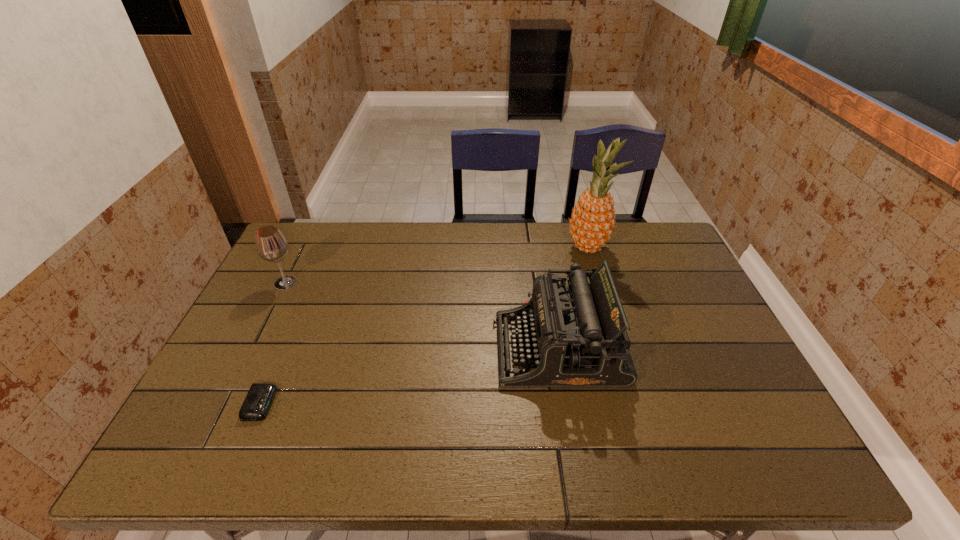
You are a GUI agent. You are given a task and a screenshot of the screen. Output one action in this format:
    pyautogui.click(x=<x>, y=<y>)
    Task: Click on the free space that is in between the typewriter and the leftmost object
    This screenshot has width=960, height=540.
    Given the screenshot: What is the action you would take?
    pyautogui.click(x=422, y=316)

Where is `vacant area between the farthest object and the shortest object`? This screenshot has width=960, height=540. vacant area between the farthest object and the shortest object is located at coordinates (424, 326).

I want to click on vacant point located between the third nearest object and the shortest object, so click(x=274, y=343).

At what (x,y) coordinates should I click in order to perform the action: click on free space that is in between the second farthest object and the third object from right to left. Please return your answer as a coordinate pair (x, y). The width and height of the screenshot is (960, 540). Looking at the image, I should click on (274, 343).

You are a GUI agent. You are given a task and a screenshot of the screen. Output one action in this format:
    pyautogui.click(x=<x>, y=<y>)
    Task: Click on the free spot between the shortest object and the wineglass
    This screenshot has width=960, height=540.
    Given the screenshot: What is the action you would take?
    pyautogui.click(x=274, y=343)

Where is `free area in between the typewriter and the alarm clock`? free area in between the typewriter and the alarm clock is located at coordinates (410, 376).

Where is `free space between the typewriter and the third object from right to left`? This screenshot has width=960, height=540. free space between the typewriter and the third object from right to left is located at coordinates (410, 376).

I want to click on vacant space that's between the second farthest object and the shortest object, so click(274, 343).

Where is `the second closest object to the shortest object`? The image size is (960, 540). the second closest object to the shortest object is located at coordinates (577, 337).

At what (x,y) coordinates should I click in order to perform the action: click on the closest object to the alarm clock. Please return your answer as a coordinate pair (x, y). This screenshot has height=540, width=960. Looking at the image, I should click on (271, 245).